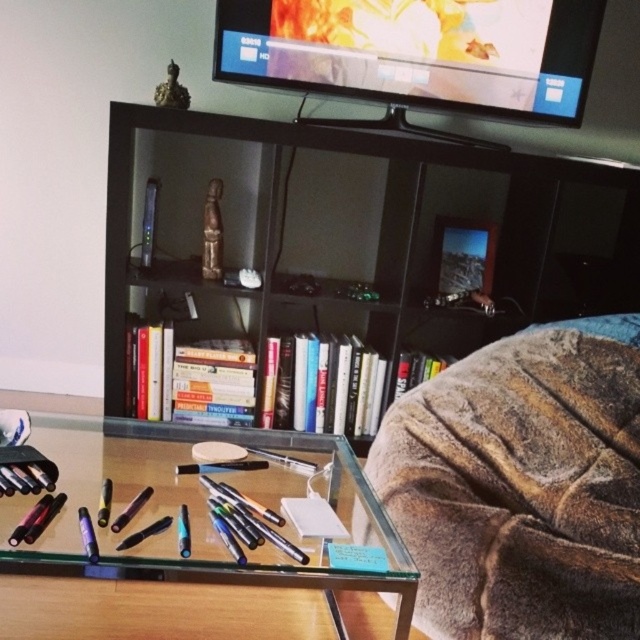
Can you confirm if transparent glass table at center is shorter than flat screen tv at upper center?

Yes.

Does point (147, 458) come in front of point (480, 90)?

Yes, it is.

Is point (129, 532) closer to viewer compared to point (552, 1)?

Yes, point (129, 532) is closer to viewer.

The width and height of the screenshot is (640, 640). What are the coordinates of `transparent glass table at center` in the screenshot? It's located at (211, 522).

Identify the location of fuzzy brown couch at lower right. (522, 484).

Who is more forward, (580,529) or (173,464)?

Point (580,529)

What do you see at coordinates (522, 484) in the screenshot? I see `fuzzy brown couch at lower right` at bounding box center [522, 484].

Locate an element on the screen. This screenshot has height=640, width=640. fuzzy brown couch at lower right is located at coordinates click(x=522, y=484).

Does black matte bookshelf at center appear over flat screen tv at upper center?

Actually, black matte bookshelf at center is below flat screen tv at upper center.

Which is above, black matte bookshelf at center or flat screen tv at upper center?

flat screen tv at upper center

What do you see at coordinates (337, 259) in the screenshot?
I see `black matte bookshelf at center` at bounding box center [337, 259].

Where is `black matte bookshelf at center`? The height and width of the screenshot is (640, 640). black matte bookshelf at center is located at coordinates (337, 259).